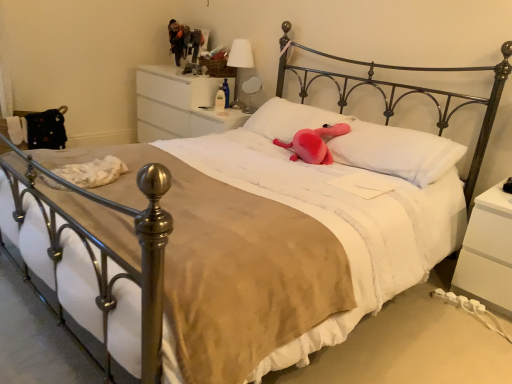
Question: From the image's perspective, is white glossy table lamp at upper center, which is counted as the first table lamp, starting from the bottom, positioned above or below white matte nightstand at lower right, the 3th nightstand when ordered from top to bottom?

Choices:
 (A) above
 (B) below

Answer: (A)

Question: Is white glossy table lamp at upper center, which is counted as the first table lamp, starting from the bottom, wider or thinner than white matte nightstand at lower right, the 1th nightstand viewed from the front?

Choices:
 (A) thin
 (B) wide

Answer: (A)

Question: Which is nearer to the white glossy table lamp at upper center, which appears as the second table lamp when viewed from the top?

Choices:
 (A) white fabric-covered table lamp at upper center, the 2th table lamp when ordered from bottom to top
 (B) white matte nightstand at lower right, the third nightstand from the left
 (C) white glossy drawer at upper center, marked as the 3th nightstand in a bottom-to-top arrangement
 (D) pink plush at center, positioned as the second pillow in left-to-right order
 (E) white soft pillow at center, placed as the 2th pillow when sorted from right to left

Answer: (A)

Question: Estimate the real-world distances between objects in this image. Which object is farther from the white soft pillow at center, the 1th pillow viewed from the left?

Choices:
 (A) pink plush at center, positioned as the second pillow in left-to-right order
 (B) white matte nightstand at lower right, marked as the 3th nightstand in a back-to-front arrangement
 (C) white glossy nightstand at upper center, the 2th nightstand from the bottom
 (D) pink plush toy at center
 (E) white glossy drawer at upper center, the third nightstand viewed from the right

Answer: (B)